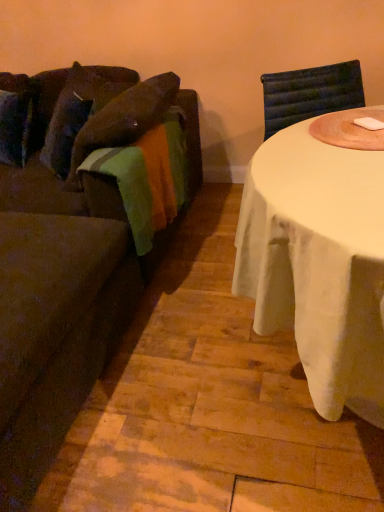
Question: Should I look upward or downward to see velvet brown couch at left?

Choices:
 (A) up
 (B) down

Answer: (A)

Question: Is there a large distance between velvety brown pillow at left and velvet brown couch at left?

Choices:
 (A) yes
 (B) no

Answer: (B)

Question: Is velvety brown pillow at left oriented towards velvet brown couch at left?

Choices:
 (A) no
 (B) yes

Answer: (B)

Question: Does velvety brown pillow at left appear on the left side of velvet brown couch at left?

Choices:
 (A) no
 (B) yes

Answer: (A)

Question: Is velvety brown pillow at left further to the viewer compared to velvet brown couch at left?

Choices:
 (A) yes
 (B) no

Answer: (A)

Question: Is velvety brown pillow at left in contact with velvet brown couch at left?

Choices:
 (A) no
 (B) yes

Answer: (A)

Question: From a real-world perspective, is velvety brown pillow at left on top of velvet brown couch at left?

Choices:
 (A) yes
 (B) no

Answer: (A)

Question: Is velvet brown couch at left smaller than velvety brown pillow at left?

Choices:
 (A) yes
 (B) no

Answer: (B)

Question: Is velvet brown couch at left oriented towards velvety brown pillow at left?

Choices:
 (A) yes
 (B) no

Answer: (B)

Question: Is velvet brown couch at left facing away from velvety brown pillow at left?

Choices:
 (A) no
 (B) yes

Answer: (B)

Question: From the image's perspective, would you say velvet brown couch at left is positioned over velvety brown pillow at left?

Choices:
 (A) yes
 (B) no

Answer: (B)

Question: Is the position of velvet brown couch at left more distant than that of velvety brown pillow at left?

Choices:
 (A) yes
 (B) no

Answer: (B)

Question: Does velvet brown couch at left have a greater height compared to velvety brown pillow at left?

Choices:
 (A) no
 (B) yes

Answer: (B)

Question: Is velvety brown pillow at left bigger or smaller than velvet brown couch at left?

Choices:
 (A) big
 (B) small

Answer: (B)